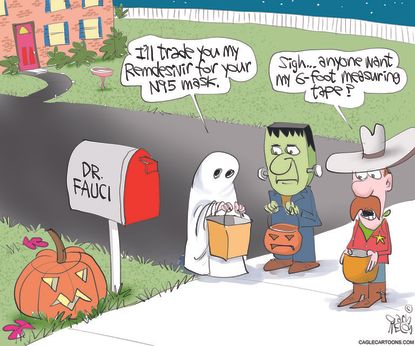
The width and height of the screenshot is (415, 346). Find the location of `door`. door is located at coordinates (23, 43).